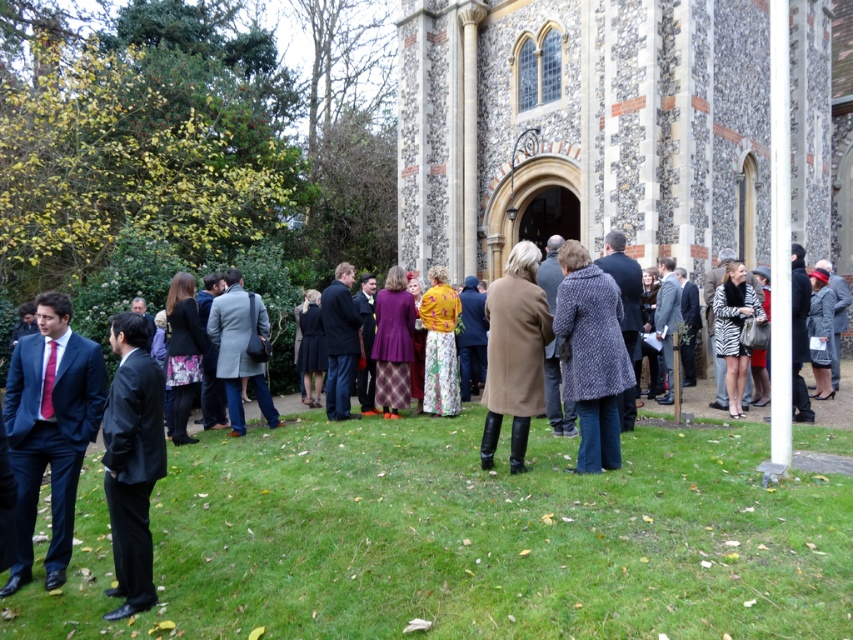
Question: Which object appears farthest from the camera in this image?

Choices:
 (A) stone mosaic chapel at center
 (B) matte brown coat at center
 (C) green grass at lower center
 (D) zebra print coat at center

Answer: (A)

Question: From the image, what is the correct spatial relationship of matte brown coat at center in relation to zebra print coat at center?

Choices:
 (A) below
 (B) above

Answer: (A)

Question: Among these objects, which one is farthest from the camera?

Choices:
 (A) velvet purple coat at center
 (B) zebra print coat at center
 (C) dark blue suit at center
 (D) dark gray suit at center

Answer: (A)

Question: Does dark gray suit at center have a lesser width compared to zebra print coat at center?

Choices:
 (A) no
 (B) yes

Answer: (B)

Question: Among these objects, which one is nearest to the camera?

Choices:
 (A) velvet purple coat at center
 (B) light gray wool coat at center
 (C) zebra print coat at center

Answer: (C)

Question: Can you confirm if green grass at lower center is positioned to the left of dark blue suit at lower left?

Choices:
 (A) no
 (B) yes

Answer: (A)